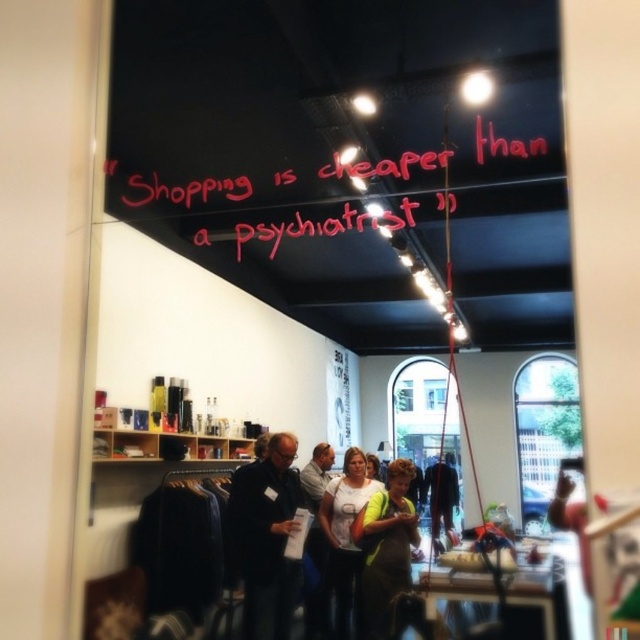
Question: Which point is closer to the camera?

Choices:
 (A) (384, 611)
 (B) (257, 589)

Answer: (A)

Question: Is pink neon sign at upper center to the right of dark blue jeans at center from the viewer's perspective?

Choices:
 (A) no
 (B) yes

Answer: (A)

Question: In this image, where is neon green reflective vest at center located relative to white t-shirt at center?

Choices:
 (A) above
 (B) below

Answer: (A)

Question: Is dark blue shirt at center wider than dark blue jeans at center?

Choices:
 (A) no
 (B) yes

Answer: (A)

Question: Which of the following is the farthest from the observer?

Choices:
 (A) (400, 172)
 (B) (449, 483)

Answer: (B)

Question: Which point is closer to the camera taking this photo?

Choices:
 (A) (452, 528)
 (B) (520, 156)
 (C) (376, 541)
 (D) (352, 448)

Answer: (B)